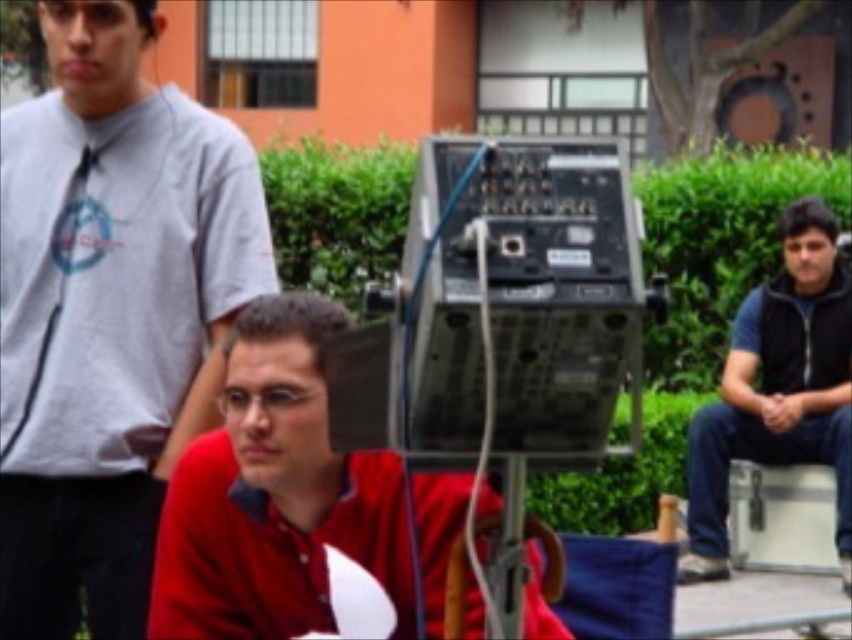
Question: Does matte red shirt at center have a greater width compared to dark blue zip-up jacket at right?

Choices:
 (A) no
 (B) yes

Answer: (A)

Question: Does matte gray shirt at left appear on the right side of matte red shirt at center?

Choices:
 (A) yes
 (B) no

Answer: (B)

Question: Is matte gray shirt at left to the left of matte red shirt at center from the viewer's perspective?

Choices:
 (A) yes
 (B) no

Answer: (A)

Question: Which point appears closest to the camera in this image?

Choices:
 (A) (102, 97)
 (B) (396, 596)

Answer: (B)

Question: Among these points, which one is farthest from the camera?

Choices:
 (A) (134, 8)
 (B) (689, 545)
 (C) (543, 609)

Answer: (B)

Question: Which of the following is the closest to the observer?

Choices:
 (A) dark blue zip-up jacket at right
 (B) matte red shirt at center
 (C) matte gray shirt at left

Answer: (B)